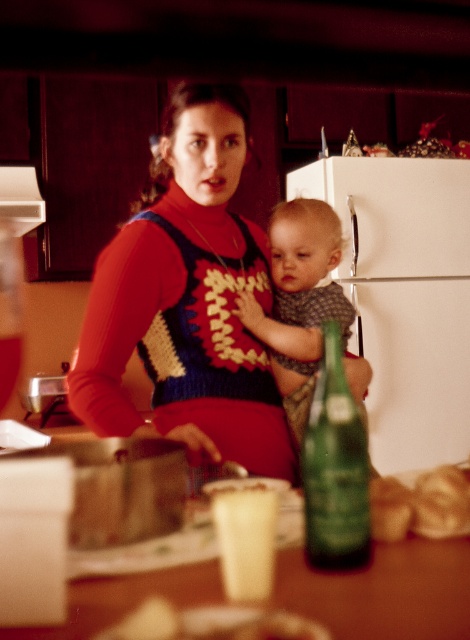
You are organizing a kitchen storage area and need to decide which item to place on a shelf that can only hold one of the two items. The shelf is just big enough for the larger item. Which item should you choose between the soft gray knit sweater at center and the green glass bottle at center?

The soft gray knit sweater at center is larger in size than the green glass bottle at center, so you should choose the soft gray knit sweater at center to place on the shelf since it is the larger item that fits the shelf size requirement.

Consider the image. You are a chef preparing ingredients on the wooden table at center and need to reach for the green glass bottle at center to pour some liquid. Can you comfortably reach the bottle without moving your position?

The wooden table at center has a lesser height compared to green glass bottle at center, so the bottle is taller than the table. This means the bottle is positioned above the table, making it easy to reach without needing to move your position.